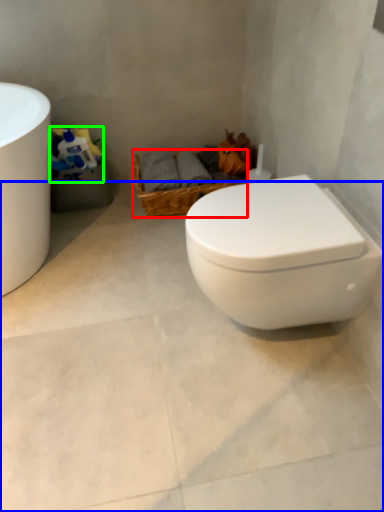
Question: Based on their relative distances, which object is farther from basket (highlighted by a red box)? Choose from concrete (highlighted by a blue box) and toilet paper (highlighted by a green box).

Choices:
 (A) concrete
 (B) toilet paper

Answer: (A)